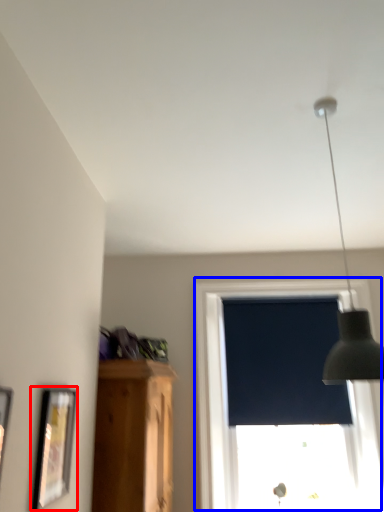
Question: Among these objects, which one is nearest to the camera, picture frame (highlighted by a red box) or window (highlighted by a blue box)?

Choices:
 (A) picture frame
 (B) window

Answer: (A)